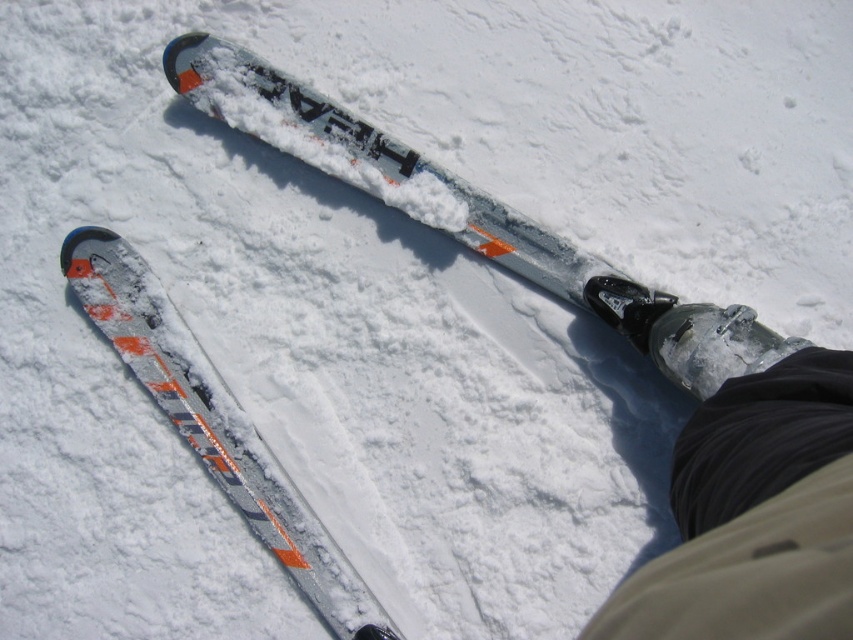
In the scene shown: You are a photographer trying to capture the black matte boot at lower right in your shot. You want to position your camera so that the boot is centered in the frame. What coordinate should you aim for to ensure the boot is perfectly centered?

The black matte boot at lower right is located at coordinate point (741,477), so you should aim your camera at that coordinate to center it in the frame.

You are a ski instructor helping a student adjust their equipment. The student has a black matte boot at lower right and a silver metallic ski at center. The student asks if their boot is positioned correctly relative to the ski. Based on the distance between them, can you confirm if the boot is within the recommended 3 feet safety distance for proper alignment?

The black matte boot at lower right is 3.42 feet from the silver metallic ski at center, which exceeds the recommended 3 feet safety distance. Therefore, the boot is not within the proper alignment range and needs to be moved closer to the ski.

In the scene shown: You are a ski instructor helping someone secure their equipment. You notice the black matte boot at lower right and the silver metallic ski at center in the image. Which object is narrower in width?

The black matte boot at lower right is thinner than the silver metallic ski at center.